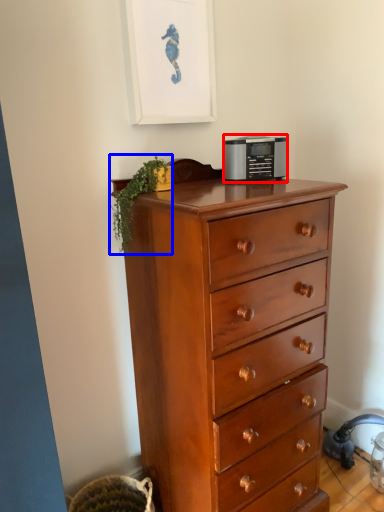
Question: Among these objects, which one is nearest to the camera, appliance (highlighted by a red box) or plant (highlighted by a blue box)?

Choices:
 (A) appliance
 (B) plant

Answer: (B)